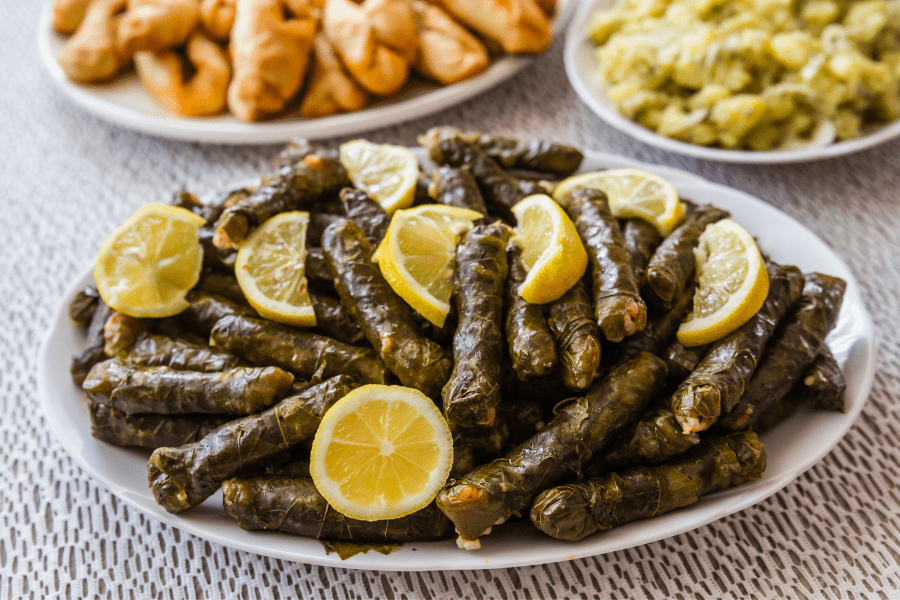
You are a GUI agent. You are given a task and a screenshot of the screen. Output one action in this format:
    pyautogui.click(x=<x>, y=<y>)
    Task: Click on the plates
    The image size is (900, 600).
    Given the screenshot: What is the action you would take?
    pyautogui.click(x=824, y=430), pyautogui.click(x=783, y=159), pyautogui.click(x=222, y=140)